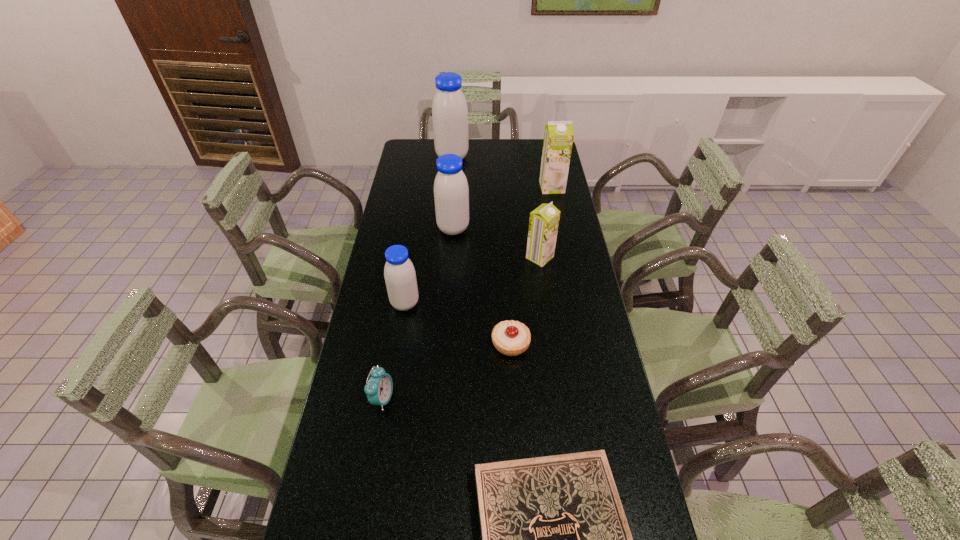
At what (x,y) coordinates should I click in order to perform the action: click on vacant position located 0.150m on the front of the pastry. Please return your answer as a coordinate pair (x, y). This screenshot has height=540, width=960. Looking at the image, I should click on (515, 407).

Identify the location of object at the far edge. This screenshot has height=540, width=960. click(449, 109).

In order to click on alarm clock located in the left edge section of the desktop in this screenshot , I will do `click(379, 388)`.

Where is `object at the far left corner`? object at the far left corner is located at coordinates (449, 109).

The width and height of the screenshot is (960, 540). In order to click on vacant area at the far edge of the desktop in this screenshot , I will do `click(514, 153)`.

The image size is (960, 540). Identify the location of vacant space at the left edge. [x=377, y=526].

The width and height of the screenshot is (960, 540). What are the coordinates of `free space at the right edge` in the screenshot? It's located at (564, 225).

Locate an element on the screen. vacant region between the second shortest object and the second smallest blue soya milk is located at coordinates (482, 286).

The width and height of the screenshot is (960, 540). I want to click on vacant region between the biggest blue soya milk and the farther green soya milk, so click(x=502, y=172).

You are a GUI agent. You are given a task and a screenshot of the screen. Output one action in this format:
    pyautogui.click(x=<x>, y=<y>)
    Task: Click on the free space that is in between the smaller green soya milk and the second smallest blue soya milk
    
    Given the screenshot: What is the action you would take?
    pyautogui.click(x=496, y=243)